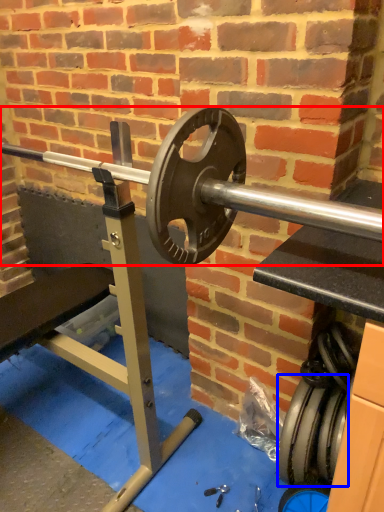
Question: Which object appears closest to the camera in this image, barbell (highlighted by a red box) or tire (highlighted by a blue box)?

Choices:
 (A) barbell
 (B) tire

Answer: (A)